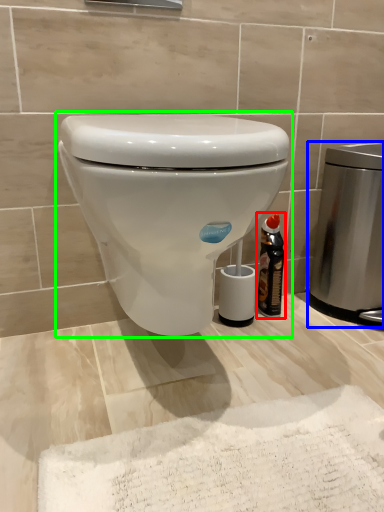
Question: Which object is positioned closest to bottle (highlighted by a red box)? Select from appliance (highlighted by a blue box) and toilet (highlighted by a green box).

Choices:
 (A) appliance
 (B) toilet

Answer: (A)